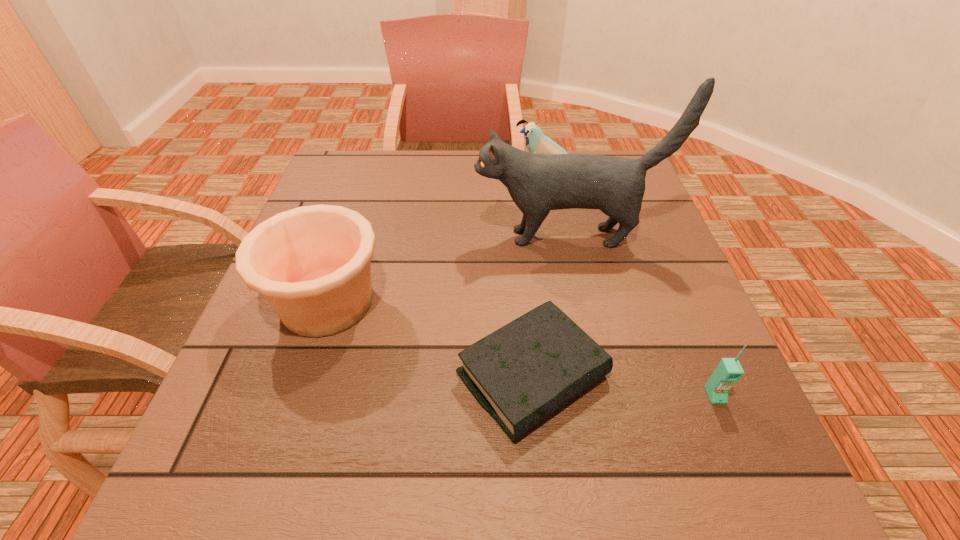
Locate an element on the screen. The image size is (960, 540). object present at the far right corner is located at coordinates (536, 142).

Find the location of a particular element. The image size is (960, 540). vacant space at the far edge of the desktop is located at coordinates (389, 181).

This screenshot has height=540, width=960. I want to click on vacant position at the near edge of the desktop, so click(390, 472).

I want to click on free region at the left edge, so click(246, 415).

The image size is (960, 540). In the image, there is a desktop. Find the location of `vacant space at the right edge`. vacant space at the right edge is located at coordinates (671, 413).

Image resolution: width=960 pixels, height=540 pixels. I want to click on vacant space at the far left corner, so click(x=352, y=178).

Identify the location of vacant region at the near left corner of the desktop. (249, 450).

Where is `free spot between the fourth tallest object and the second farthest object`? free spot between the fourth tallest object and the second farthest object is located at coordinates (641, 316).

You are a GUI agent. You are given a task and a screenshot of the screen. Output one action in this format:
    pyautogui.click(x=<x>, y=<y>)
    Task: Click on the vacant point located between the second farthest object and the pottery
    The height and width of the screenshot is (540, 960).
    Given the screenshot: What is the action you would take?
    pyautogui.click(x=447, y=269)

Find the location of `free area in between the fourth nearest object and the pottery`. free area in between the fourth nearest object and the pottery is located at coordinates (447, 269).